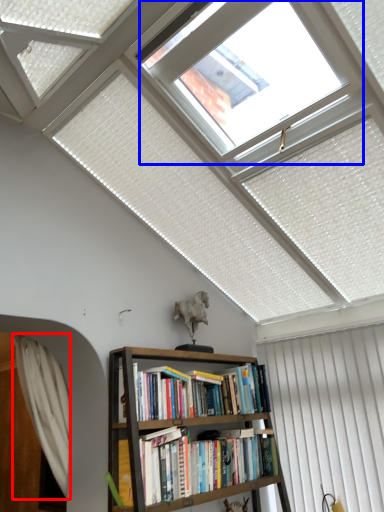
Question: Which point is further to the camera, curtain (highlighted by a red box) or bay window (highlighted by a blue box)?

Choices:
 (A) curtain
 (B) bay window

Answer: (A)